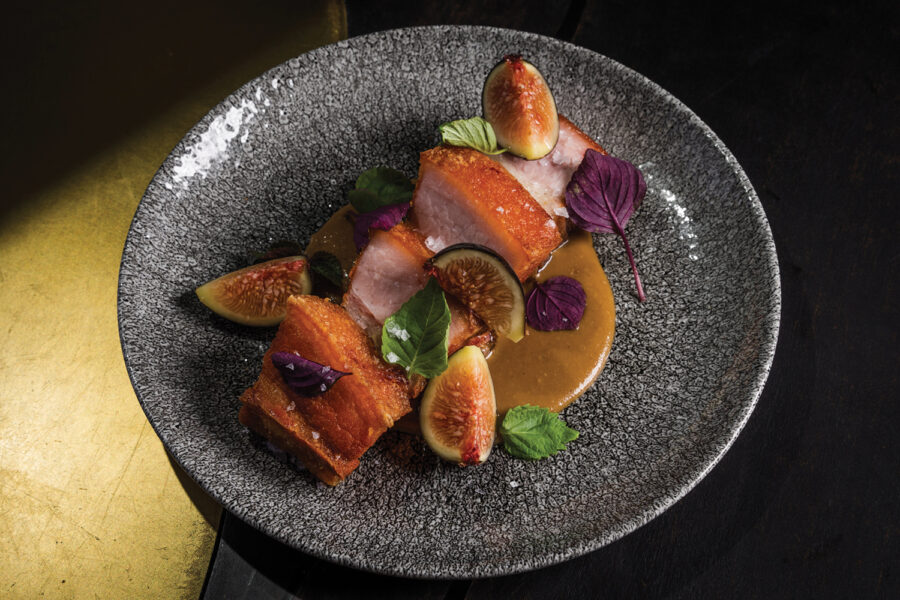
The image size is (900, 600). In order to click on plate in this screenshot , I will do `click(254, 156)`.